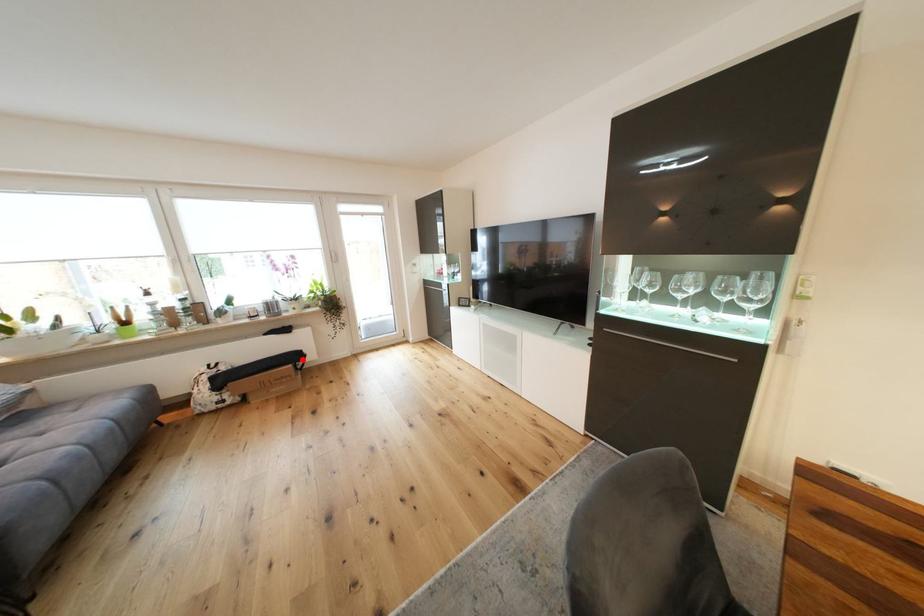
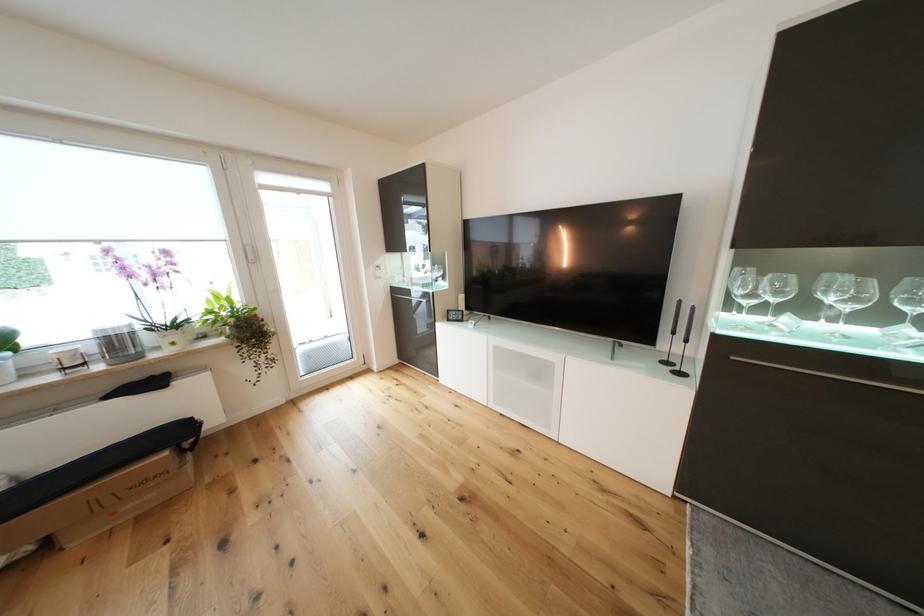
Question: I am providing you with two images of the same scene from different viewpoints. In image1, a red point is highlighted. Considering the same 3D point in image2, which of the following is correct?

Choices:
 (A) It is closer
 (B) It is farther

Answer: (B)